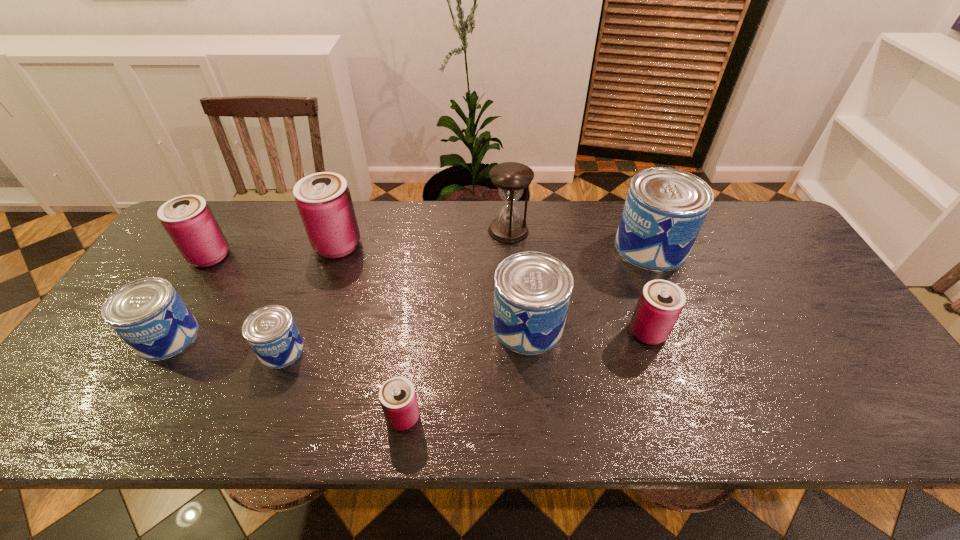
Image resolution: width=960 pixels, height=540 pixels. In order to click on free space at the left edge in this screenshot , I will do `click(197, 282)`.

The height and width of the screenshot is (540, 960). What are the coordinates of `free region at the far left corner of the desktop` in the screenshot? It's located at (241, 214).

You are a GUI agent. You are given a task and a screenshot of the screen. Output one action in this format:
    pyautogui.click(x=<x>, y=<y>)
    Task: Click on the free point between the hourglass and the leftmost blue can
    
    Given the screenshot: What is the action you would take?
    pyautogui.click(x=338, y=284)

Where is `free space that is in between the third pink can from right to left and the third smallest blue can`? free space that is in between the third pink can from right to left and the third smallest blue can is located at coordinates (433, 285).

This screenshot has height=540, width=960. I want to click on free space between the biggest blue can and the smallest blue can, so click(467, 298).

At what (x,y) coordinates should I click in order to perform the action: click on blank region between the second smallest blue can and the biggest pink can. Please return your answer as a coordinate pair (x, y). The image size is (960, 540). Looking at the image, I should click on (252, 291).

This screenshot has height=540, width=960. Identify the location of vacant area that lies between the second smallest pink can and the hourglass. (578, 281).

I want to click on empty location between the fifth object from left to right and the second blue can from left to right, so click(343, 383).

I want to click on blank region between the hourglass and the second blue can from left to right, so click(395, 290).

The height and width of the screenshot is (540, 960). I want to click on vacant space in between the second smallest blue can and the leftmost pink can, so click(x=189, y=296).